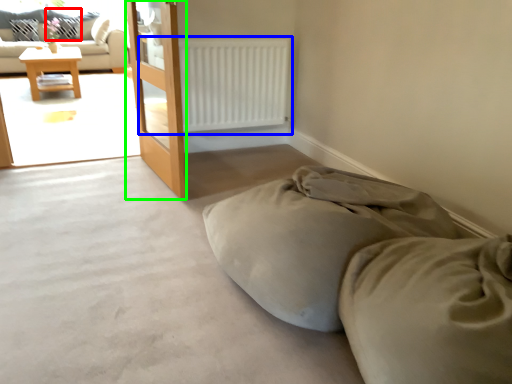
Question: Estimate the real-world distances between objects in this image. Which object is closer to pillow (highlighted by a red box), radiator (highlighted by a blue box) or screen door (highlighted by a green box)?

Choices:
 (A) radiator
 (B) screen door

Answer: (A)